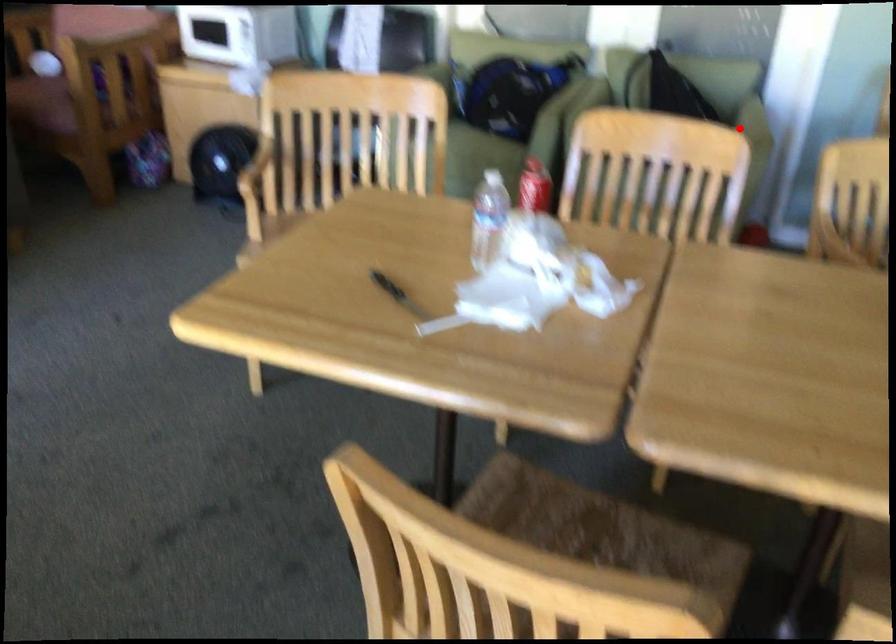
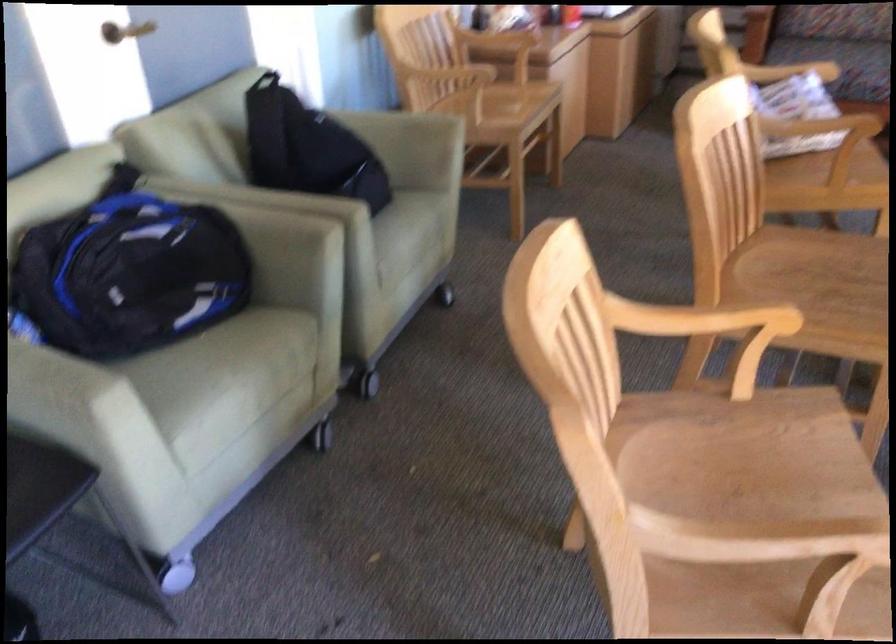
Locate, in the second image, the point that corresponds to the highlighted location in the first image.

(405, 124)